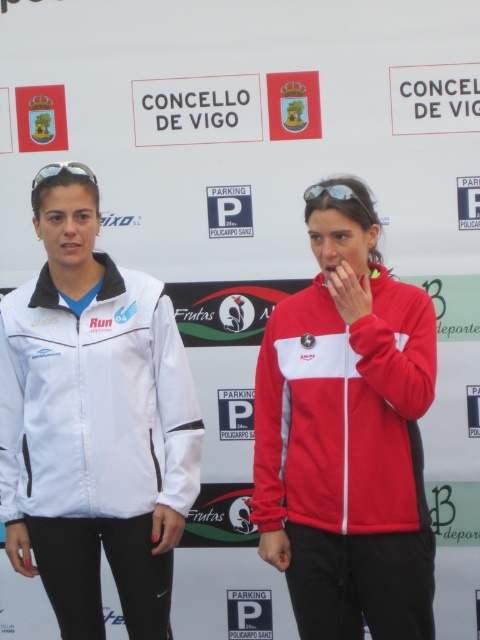
Can you confirm if red fleece jacket at center is smaller than matte black goggles at upper left?

Actually, red fleece jacket at center might be larger than matte black goggles at upper left.

Which is behind, point (409, 305) or point (71, 170)?

The point (71, 170) is behind.

What do you see at coordinates (344, 412) in the screenshot? The width and height of the screenshot is (480, 640). I see `red fleece jacket at center` at bounding box center [344, 412].

The height and width of the screenshot is (640, 480). Find the location of `red fleece jacket at center`. red fleece jacket at center is located at coordinates (344, 412).

Based on the photo, does white softshell jacket at left have a greater width compared to matte black goggles at upper left?

Indeed, white softshell jacket at left has a greater width compared to matte black goggles at upper left.

The width and height of the screenshot is (480, 640). What are the coordinates of `white softshell jacket at left` in the screenshot? It's located at (96, 403).

Between red fleece jacket at center and matte black sunglasses at center, which one has less height?

matte black sunglasses at center

Does point (303, 352) come closer to viewer compared to point (305, 198)?

No, it is behind (305, 198).

You are a GUI agent. You are given a task and a screenshot of the screen. Output one action in this format:
    pyautogui.click(x=<x>, y=<y>)
    Task: Click on the red fleece jacket at center
    
    Given the screenshot: What is the action you would take?
    pyautogui.click(x=344, y=412)